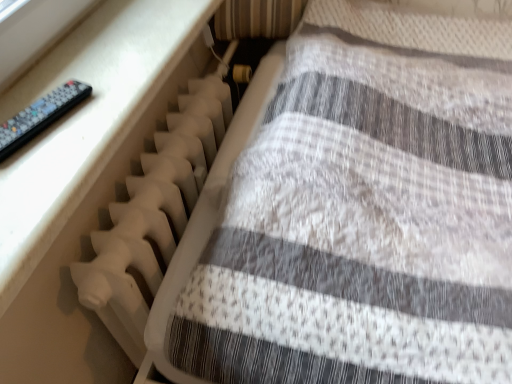
Question: Would you consider black plastic remote at left to be distant from white plastic radiator at lower left?

Choices:
 (A) no
 (B) yes

Answer: (A)

Question: From a real-world perspective, is black plastic remote at left positioned over white plastic radiator at lower left based on gravity?

Choices:
 (A) no
 (B) yes

Answer: (B)

Question: From the image's perspective, is black plastic remote at left on white plastic radiator at lower left?

Choices:
 (A) no
 (B) yes

Answer: (B)

Question: Is black plastic remote at left next to white plastic radiator at lower left and touching it?

Choices:
 (A) yes
 (B) no

Answer: (B)

Question: Is black plastic remote at left further to the viewer compared to white plastic radiator at lower left?

Choices:
 (A) yes
 (B) no

Answer: (A)

Question: From their relative heights in the image, would you say black plastic remote at left is taller or shorter than white plastic radiator at left?

Choices:
 (A) tall
 (B) short

Answer: (B)

Question: Considering the positions of black plastic remote at left and white plastic radiator at left in the image, is black plastic remote at left bigger or smaller than white plastic radiator at left?

Choices:
 (A) small
 (B) big

Answer: (A)

Question: From the image's perspective, is black plastic remote at left above or below white plastic radiator at left?

Choices:
 (A) above
 (B) below

Answer: (A)

Question: Considering the relative positions of black plastic remote at left and white plastic radiator at left in the image provided, is black plastic remote at left to the left or to the right of white plastic radiator at left?

Choices:
 (A) right
 (B) left

Answer: (B)

Question: Visually, is white plastic radiator at lower left positioned to the left or to the right of black plastic remote at left?

Choices:
 (A) right
 (B) left

Answer: (A)

Question: From the image's perspective, relative to black plastic remote at left, is white plastic radiator at lower left above or below?

Choices:
 (A) below
 (B) above

Answer: (A)

Question: Considering the positions of white plastic radiator at lower left and black plastic remote at left in the image, is white plastic radiator at lower left bigger or smaller than black plastic remote at left?

Choices:
 (A) small
 (B) big

Answer: (B)

Question: In the image, is white plastic radiator at lower left positioned in front of or behind black plastic remote at left?

Choices:
 (A) behind
 (B) front

Answer: (B)

Question: Is white plastic radiator at lower left bigger or smaller than white plastic radiator at left?

Choices:
 (A) big
 (B) small

Answer: (A)

Question: From the image's perspective, is white plastic radiator at lower left positioned above or below white plastic radiator at left?

Choices:
 (A) below
 (B) above

Answer: (B)